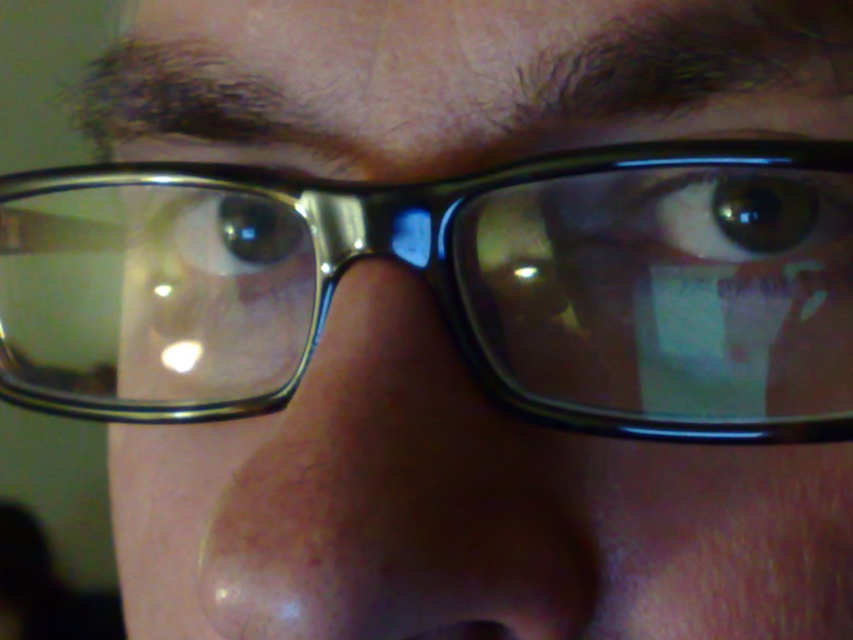
Question: Can you confirm if clear skin nose at center is smaller than brown glossy eye at center?

Choices:
 (A) yes
 (B) no

Answer: (B)

Question: Which of the following is the farthest from the observer?

Choices:
 (A) (270, 232)
 (B) (842, 220)
 (C) (538, 170)

Answer: (A)

Question: Based on their relative distances, which object is farther from the clear plastic glasses at center?

Choices:
 (A) green matte eye at center
 (B) clear skin nose at center

Answer: (A)

Question: Is green matte eye at center to the right of brown glossy eye at center from the viewer's perspective?

Choices:
 (A) yes
 (B) no

Answer: (A)

Question: Can you confirm if clear plastic glasses at center is positioned above green matte eye at center?

Choices:
 (A) yes
 (B) no

Answer: (B)

Question: Among these points, which one is farthest from the camera?

Choices:
 (A) (714, 250)
 (B) (718, 292)
 (C) (268, 266)
 (D) (547, 602)

Answer: (C)